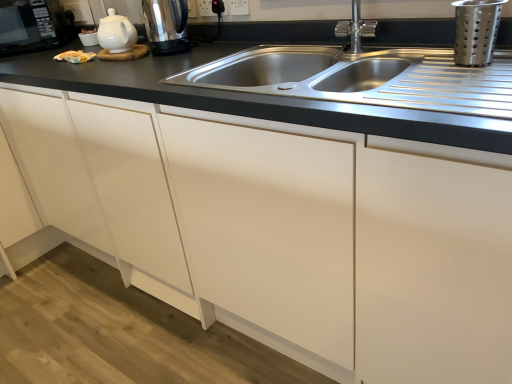
The width and height of the screenshot is (512, 384). Find the location of `vacant space in front of polished stainless steel kettle at upper left`. vacant space in front of polished stainless steel kettle at upper left is located at coordinates (169, 66).